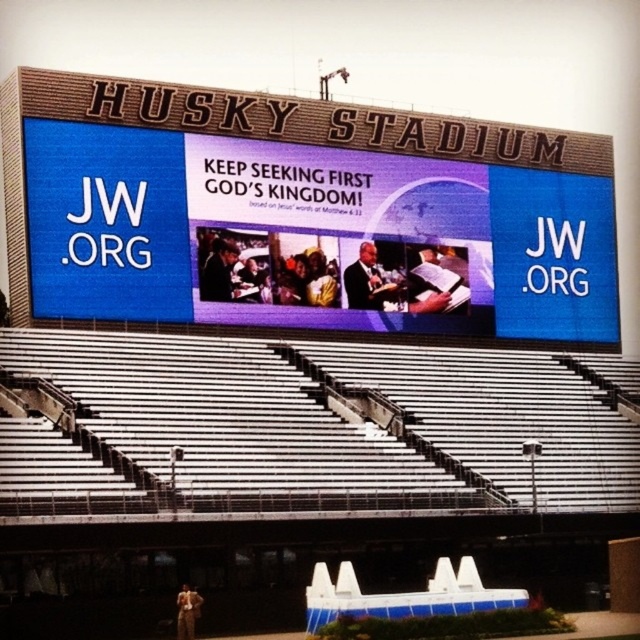
Who is lower down, metallic silver bleachers at lower center or dark suit at center?

Positioned lower is metallic silver bleachers at lower center.

Identify the location of metallic silver bleachers at lower center. (307, 428).

Is point (296, 444) positioned behind point (214, 285)?

No, (296, 444) is closer to viewer.

Is metallic silver bleachers at lower center closer to the viewer compared to matte black suit at center?

Yes.

You are a GUI agent. You are given a task and a screenshot of the screen. Output one action in this format:
    pyautogui.click(x=<x>, y=<y>)
    Task: Click on the metallic silver bleachers at lower center
    This screenshot has width=640, height=640.
    Given the screenshot: What is the action you would take?
    pyautogui.click(x=307, y=428)

The height and width of the screenshot is (640, 640). I want to click on blue led display at upper center, so click(300, 211).

Is point (291, 288) positioned after point (36, 461)?

Yes, point (291, 288) is farther from viewer.

You are a GUI agent. You are given a task and a screenshot of the screen. Output one action in this format:
    pyautogui.click(x=<x>, y=<y>)
    Task: Click on the blue led display at upper center
    
    Given the screenshot: What is the action you would take?
    pyautogui.click(x=300, y=211)

Where is `blue led display at upper center`? This screenshot has width=640, height=640. blue led display at upper center is located at coordinates (300, 211).